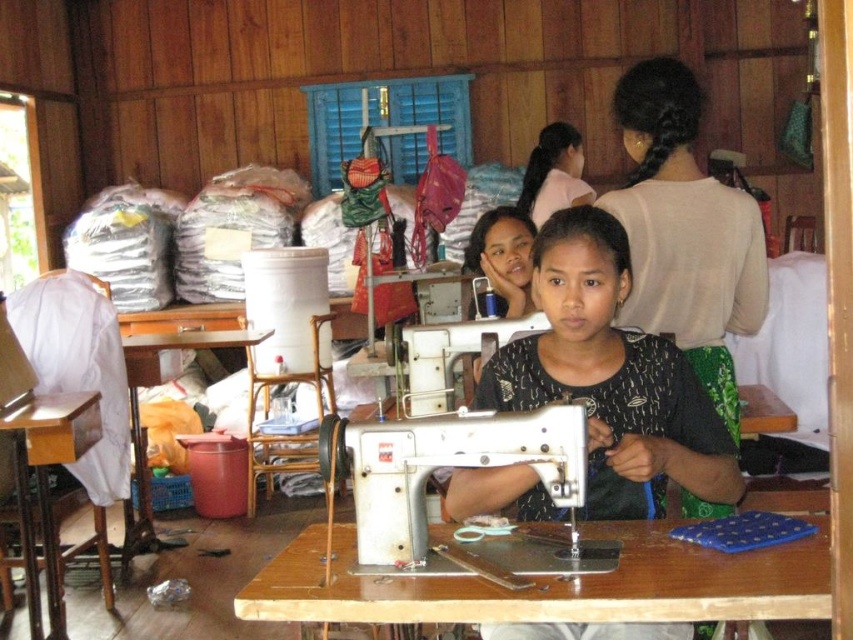
Question: Can you confirm if white metallic sewing machine at center is positioned to the right of wooden table at lower left?

Choices:
 (A) yes
 (B) no

Answer: (A)

Question: Can you confirm if black matte shirt at center is bigger than light pink fabric at upper center?

Choices:
 (A) yes
 (B) no

Answer: (A)

Question: Which point is farther from the camera taking this photo?

Choices:
 (A) (682, 600)
 (B) (144, 525)

Answer: (B)

Question: Which object is the closest to the light pink fabric at upper center?

Choices:
 (A) light beige sweater at upper right
 (B) wooden table at lower left

Answer: (B)

Question: Can you confirm if white metallic sewing machine at center is positioned to the left of wooden desk at lower left?

Choices:
 (A) yes
 (B) no

Answer: (B)

Question: Which point is closer to the camera?

Choices:
 (A) light pink fabric at upper center
 (B) white metallic sewing machine at center

Answer: (B)